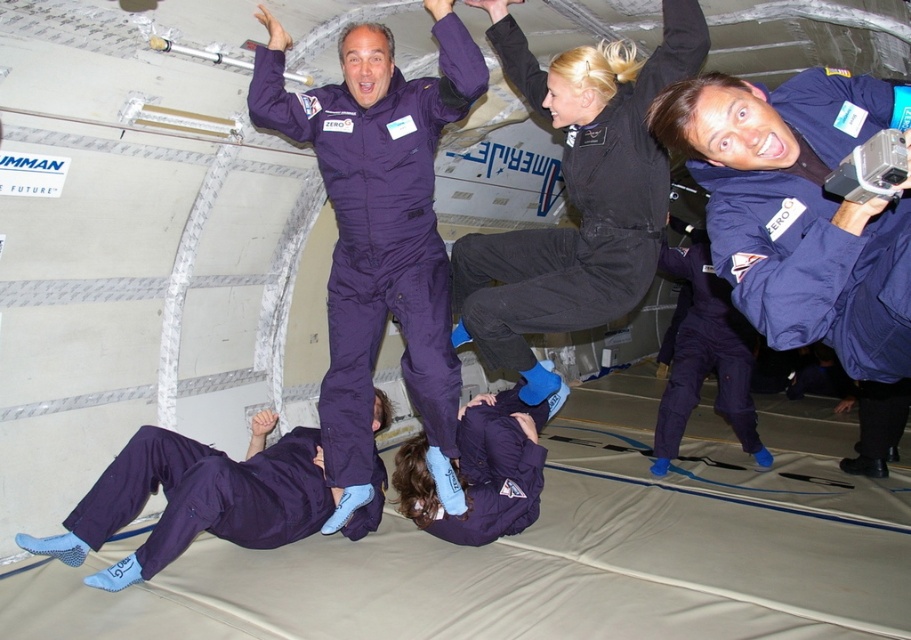
You are a flight attendant on the zero gravity aircraft. You need to retrieve both the purple smooth jumpsuit at upper center and the matte blue jumpsuit at upper right. Which jumpsuit should you grab first if you want to reach the one closer to the left side of the cabin?

The purple smooth jumpsuit at upper center is positioned on the left side of the matte blue jumpsuit at upper right, so you should grab the purple smooth jumpsuit at upper center first as it is closer to the left side of the cabin.

You are a photographer positioned at the camera in the aircraft cabin. You want to capture a closeup shot of the matte blue jumpsuit at center. Considering the distance between you and the subject, is it possible to focus on the jumpsuit without moving closer?

The matte blue jumpsuit at center is 1.13 meters away from camera. Most professional cameras can focus on subjects at this distance, so yes, it is possible to focus on the matte blue jumpsuit at center without moving closer.